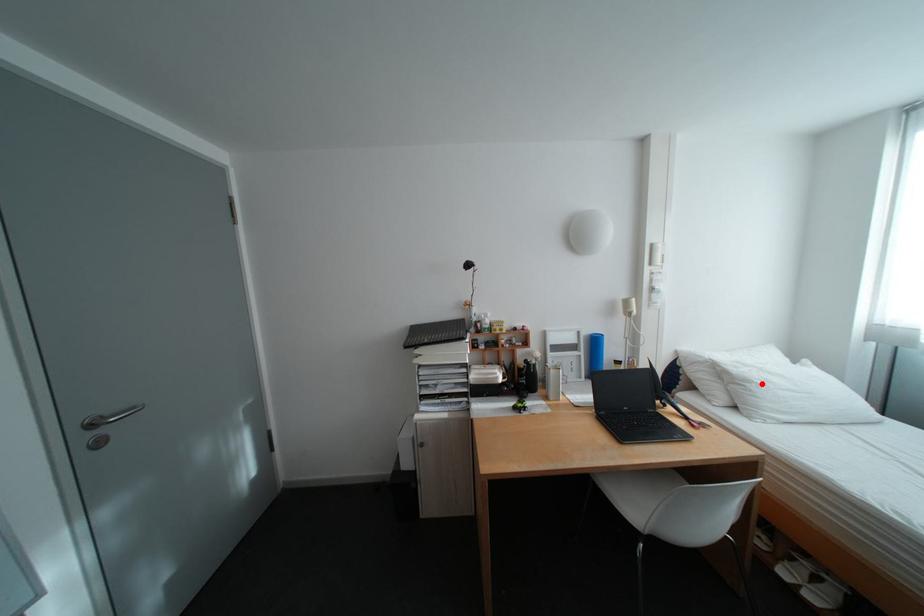
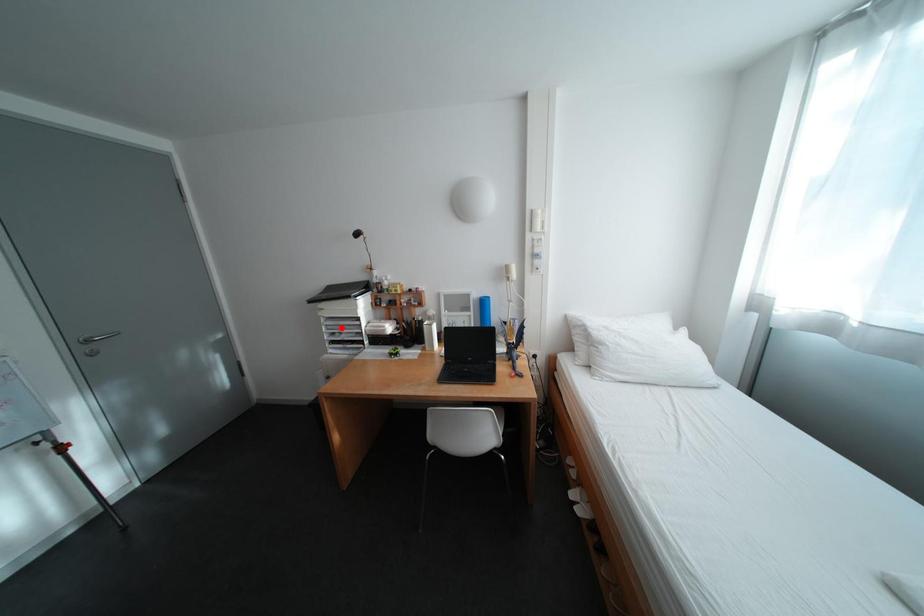
I am providing you with two images of the same scene from different viewpoints. A red point is marked on the first image and another point is marked on the second image. Does the point marked in image1 correspond to the same location as the one in image2?

No